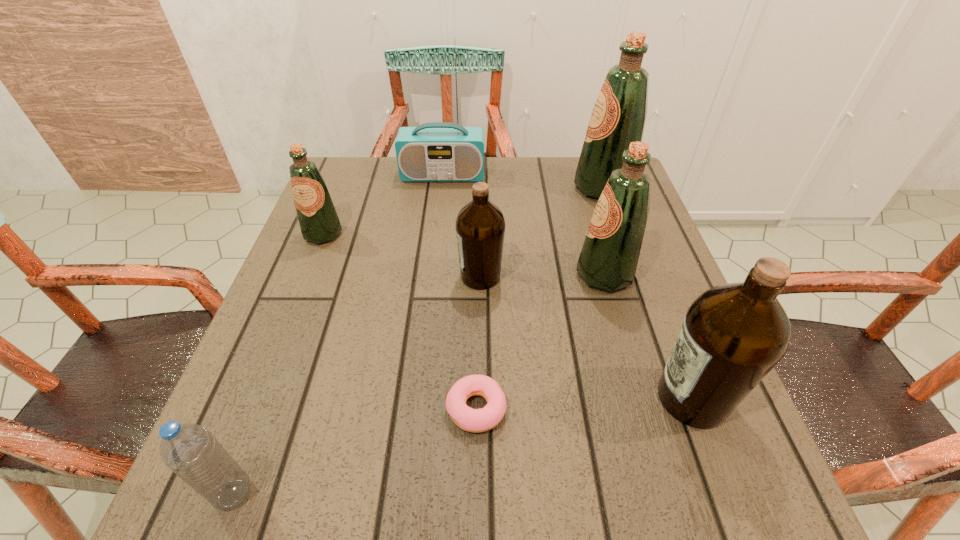
Identify the location of the nearest object. (189, 450).

You are a GUI agent. You are given a task and a screenshot of the screen. Output one action in this format:
    pyautogui.click(x=<x>, y=<y>)
    Task: Click on the seventh tallest object
    This screenshot has width=960, height=540.
    Given the screenshot: What is the action you would take?
    pyautogui.click(x=189, y=450)

Image resolution: width=960 pixels, height=540 pixels. Identify the location of pink doughnut. (472, 420).

Locate an element on the screen. The width and height of the screenshot is (960, 540). doughnut is located at coordinates (472, 420).

Where is `vacant space located 0.180m on the front-facing side of the tallest olive oil`? The image size is (960, 540). vacant space located 0.180m on the front-facing side of the tallest olive oil is located at coordinates (505, 187).

Locate an element on the screen. free location located 0.050m on the front-facing side of the tallest olive oil is located at coordinates (554, 187).

Where is `vacant position located on the front-facing side of the tallest olive oil`? vacant position located on the front-facing side of the tallest olive oil is located at coordinates (513, 187).

Identify the location of vacant position located on the front panel of the light radio receiver. The image size is (960, 540). (441, 195).

This screenshot has width=960, height=540. I want to click on blank space located 0.300m on the front-facing side of the second smallest green olive oil, so click(x=434, y=274).

This screenshot has height=540, width=960. I want to click on vacant area situated 0.240m on the front-facing side of the second smallest green olive oil, so click(463, 274).